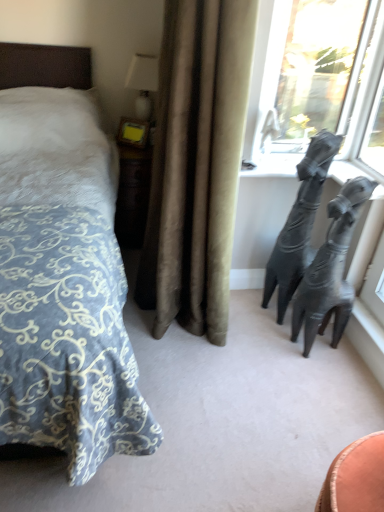
This screenshot has width=384, height=512. What are the coordinates of `free point in front of shiny metallic sculpture at right` in the screenshot? It's located at (313, 370).